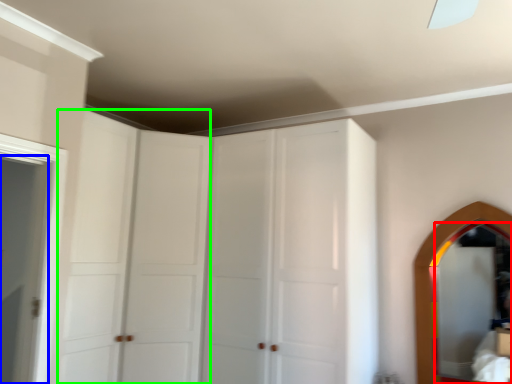
Question: Estimate the real-world distances between objects in this image. Which object is closer to mirror (highlighted by a red box), door (highlighted by a blue box) or glass door (highlighted by a green box)?

Choices:
 (A) door
 (B) glass door

Answer: (B)